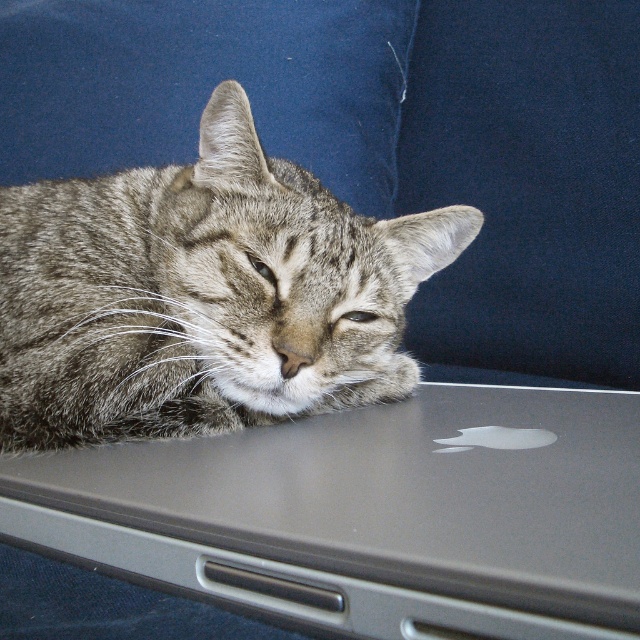
Question: Which point is closer to the camera?

Choices:
 (A) gray tabby cat at center
 (B) satin silver laptop at upper center

Answer: (B)

Question: Is satin silver laptop at upper center bigger than gray tabby cat at center?

Choices:
 (A) yes
 (B) no

Answer: (B)

Question: Does satin silver laptop at upper center have a larger size compared to gray tabby cat at center?

Choices:
 (A) yes
 (B) no

Answer: (B)

Question: Does satin silver laptop at upper center have a smaller size compared to gray tabby cat at center?

Choices:
 (A) yes
 (B) no

Answer: (A)